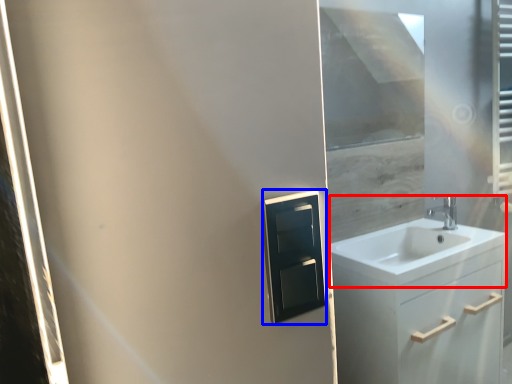
Question: Which object is further to the camera taking this photo, sink (highlighted by a red box) or medicine cabinet (highlighted by a blue box)?

Choices:
 (A) sink
 (B) medicine cabinet

Answer: (A)